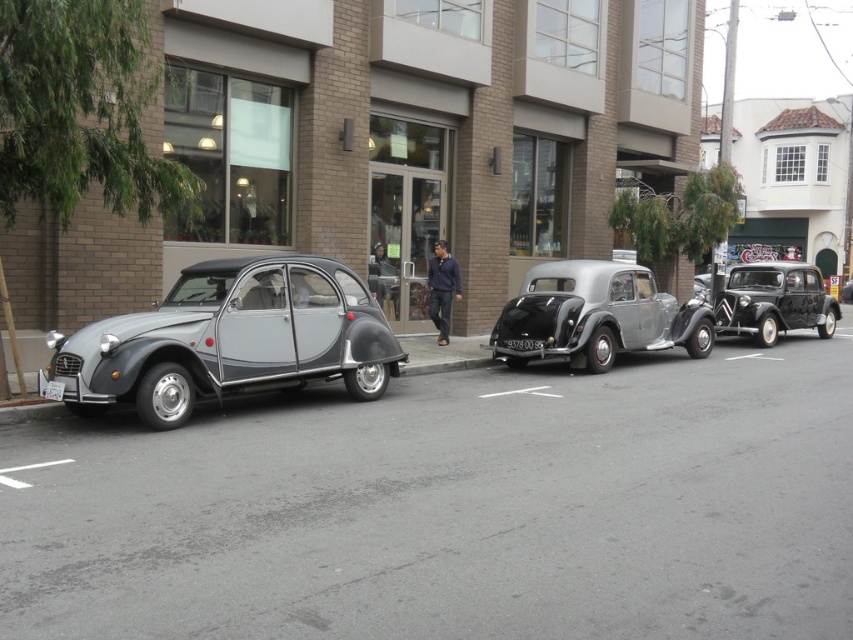
Does metallic silver car at center have a smaller size compared to black plastic license plate at center?

Actually, metallic silver car at center might be larger than black plastic license plate at center.

From the picture: Can you confirm if metallic silver car at center is wider than black plastic license plate at center?

Correct, the width of metallic silver car at center exceeds that of black plastic license plate at center.

Is point (610, 310) behind point (541, 340)?

Yes, point (610, 310) is farther from viewer.

The height and width of the screenshot is (640, 853). I want to click on metallic silver car at center, so click(x=596, y=316).

Which is above, black glossy sedan at right or navy blue sweater at center?

black glossy sedan at right

In the scene shown: Is the position of black glossy sedan at right more distant than that of navy blue sweater at center?

Yes.

What are the coordinates of `black glossy sedan at right` in the screenshot? It's located at click(x=775, y=301).

Does white plastic license plate at center have a greater width compared to shiny silver car at center?

No.

Who is more forward, (49, 387) or (851, 282)?

Point (49, 387)

Is point (45, 396) positioned in front of point (846, 298)?

Yes, it is.

Locate an element on the screen. Image resolution: width=853 pixels, height=640 pixels. white plastic license plate at center is located at coordinates [x=53, y=390].